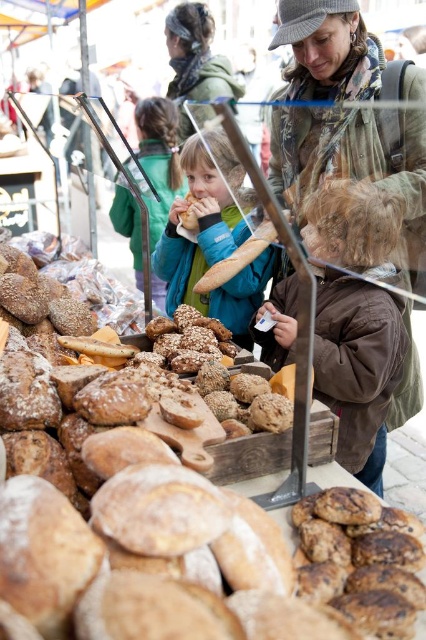
Is blue fleece jacket at center positioned before slightly toasted bread at center?

No, it is not.

Is blue fleece jacket at center behind slightly toasted bread at center?

That is True.

You are a GUI agent. You are given a task and a screenshot of the screen. Output one action in this format:
    pyautogui.click(x=<x>, y=<y>)
    Task: Click on the blue fleece jacket at center
    Image resolution: width=426 pixels, height=640 pixels.
    Given the screenshot: What is the action you would take?
    pyautogui.click(x=158, y=160)

Consider the image. Is blue denim jacket at center wider than blue fleece jacket at center?

In fact, blue denim jacket at center might be narrower than blue fleece jacket at center.

Who is taller, blue denim jacket at center or blue fleece jacket at center?

blue fleece jacket at center

Where is `blue denim jacket at center`? Image resolution: width=426 pixels, height=640 pixels. blue denim jacket at center is located at coordinates (x=210, y=250).

The width and height of the screenshot is (426, 640). Describe the element at coordinates (354, 161) in the screenshot. I see `camouflage jacket at center` at that location.

Who is lower down, camouflage jacket at center or blue denim jacket at center?

blue denim jacket at center is lower down.

What do you see at coordinates (354, 161) in the screenshot? The image size is (426, 640). I see `camouflage jacket at center` at bounding box center [354, 161].

Where is `camouflage jacket at center`? camouflage jacket at center is located at coordinates (354, 161).